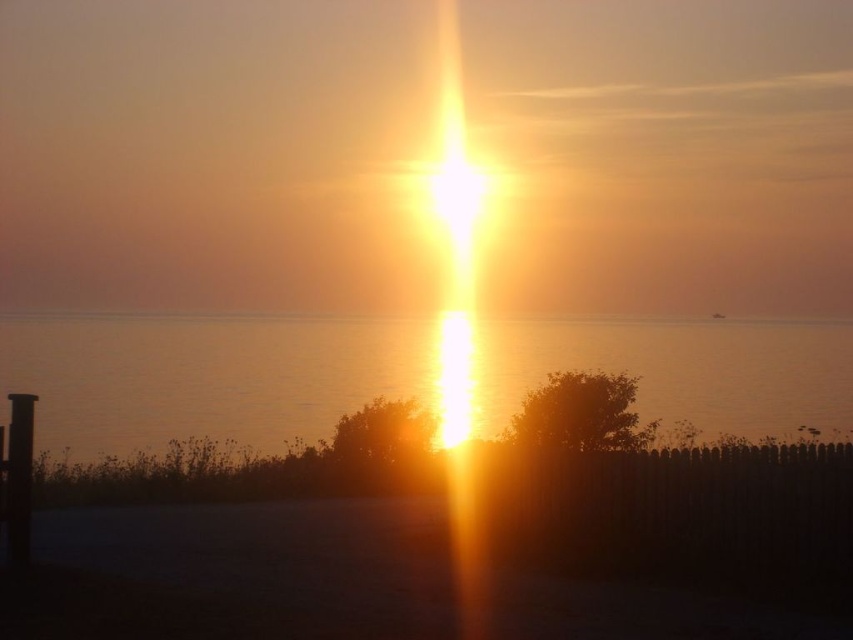
Is point (209, 422) positioned in front of point (32, 403)?

No, it is not.

Who is taller, silvery water at center or black matte pole at left?

silvery water at center is taller.

Does point (570, 344) lie behind point (9, 460)?

Yes, point (570, 344) is farther from viewer.

The height and width of the screenshot is (640, 853). What are the coordinates of `silvery water at center` in the screenshot? It's located at (206, 378).